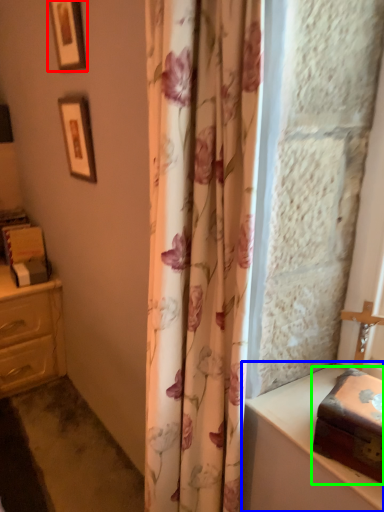
Question: Which is farther away from picture frame (highlighted by a red box)? vanity (highlighted by a blue box) or box (highlighted by a green box)?

Choices:
 (A) vanity
 (B) box

Answer: (B)